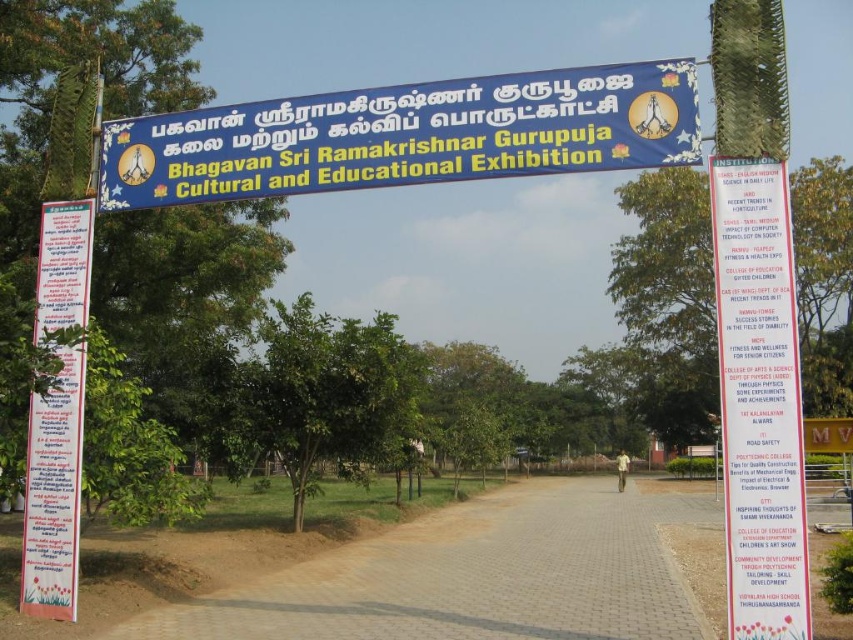
Can you confirm if white paper list at right is thinner than white paper sign at left?

Indeed, white paper list at right has a lesser width compared to white paper sign at left.

Which is more to the left, white paper list at right or white paper sign at left?

From the viewer's perspective, white paper sign at left appears more on the left side.

Is point (752, 516) positioned after point (42, 289)?

No, (752, 516) is closer to viewer.

This screenshot has width=853, height=640. Identify the location of white paper list at right. (759, 401).

Does blue fabric banner at upper center have a lesser height compared to white paper list at right?

Yes.

Who is higher up, blue fabric banner at upper center or white paper list at right?

blue fabric banner at upper center is higher up.

Does point (108, 157) lie behind point (766, 611)?

That is True.

In order to click on blue fabric banner at upper center in this screenshot , I will do `click(405, 134)`.

Is blue fabric banner at upper center to the left of white paper sign at left from the viewer's perspective?

Incorrect, blue fabric banner at upper center is not on the left side of white paper sign at left.

Is blue fabric banner at upper center to the right of white paper sign at left from the viewer's perspective?

Yes, blue fabric banner at upper center is to the right of white paper sign at left.

This screenshot has width=853, height=640. I want to click on blue fabric banner at upper center, so click(x=405, y=134).